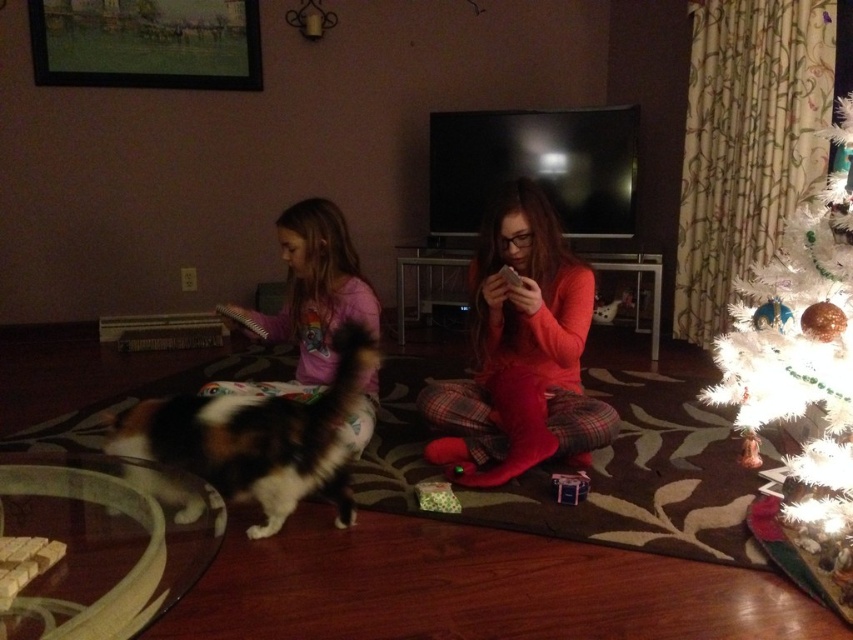
Question: Which object appears closest to the camera in this image?

Choices:
 (A) matte red pajamas at center
 (B) white artificial christmas tree at right

Answer: (B)

Question: Which object is positioned closest to the pink fleece pajamas at left?

Choices:
 (A) matte red pajamas at center
 (B) white artificial christmas tree at right

Answer: (A)

Question: Does matte red pajamas at center lie in front of pink fleece pajamas at left?

Choices:
 (A) yes
 (B) no

Answer: (B)

Question: Is matte red pajamas at center above white artificial christmas tree at right?

Choices:
 (A) yes
 (B) no

Answer: (A)

Question: Which object is the farthest from the white artificial christmas tree at right?

Choices:
 (A) pink fleece pajamas at left
 (B) matte red pajamas at center

Answer: (A)

Question: Is matte red pajamas at center thinner than white artificial christmas tree at right?

Choices:
 (A) yes
 (B) no

Answer: (B)